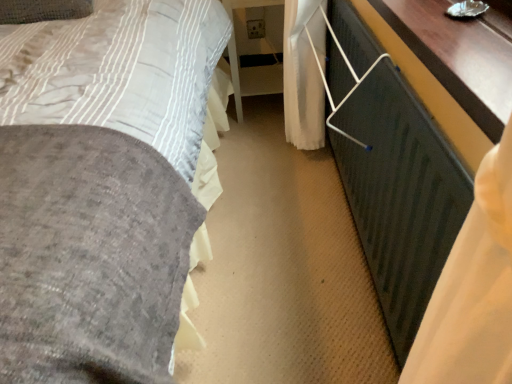
This screenshot has width=512, height=384. In order to click on unoccupied space behind metallic silver balustrade at lower right in this screenshot , I will do `click(289, 177)`.